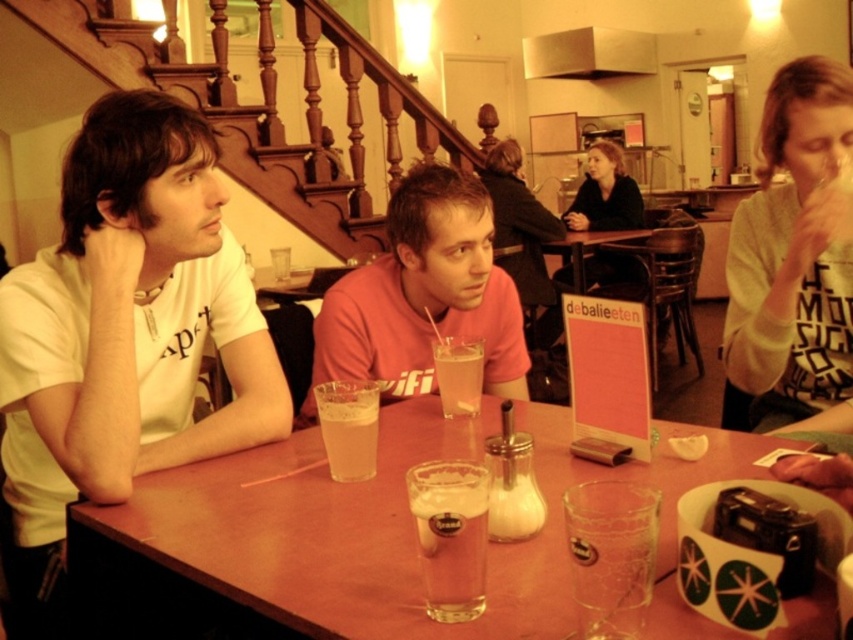
Based on the photo, does white matte t-shirt at left have a greater width compared to pink matte shirt at center?

Yes.

Can you confirm if white matte t-shirt at left is smaller than pink matte shirt at center?

No.

Is point (161, 195) in front of point (416, 285)?

Yes, it is.

Where is `white matte t-shirt at left`? The image size is (853, 640). white matte t-shirt at left is located at coordinates (125, 332).

Does light beige sweater at right appear on the right side of white creamy milkshake at table center?

Indeed, light beige sweater at right is positioned on the right side of white creamy milkshake at table center.

Consider the image. Is light beige sweater at right above white creamy milkshake at table center?

Correct, light beige sweater at right is located above white creamy milkshake at table center.

Does point (775, 397) come in front of point (502, 525)?

No, it is behind (502, 525).

Where is `light beige sweater at right`? light beige sweater at right is located at coordinates (796, 256).

Does white matte t-shirt at left appear on the left side of clear glass at table center?

Yes, white matte t-shirt at left is to the left of clear glass at table center.

Is white matte t-shirt at left to the right of clear glass at table center from the viewer's perspective?

Incorrect, white matte t-shirt at left is not on the right side of clear glass at table center.

Find the location of a particular element. white matte t-shirt at left is located at coordinates (125, 332).